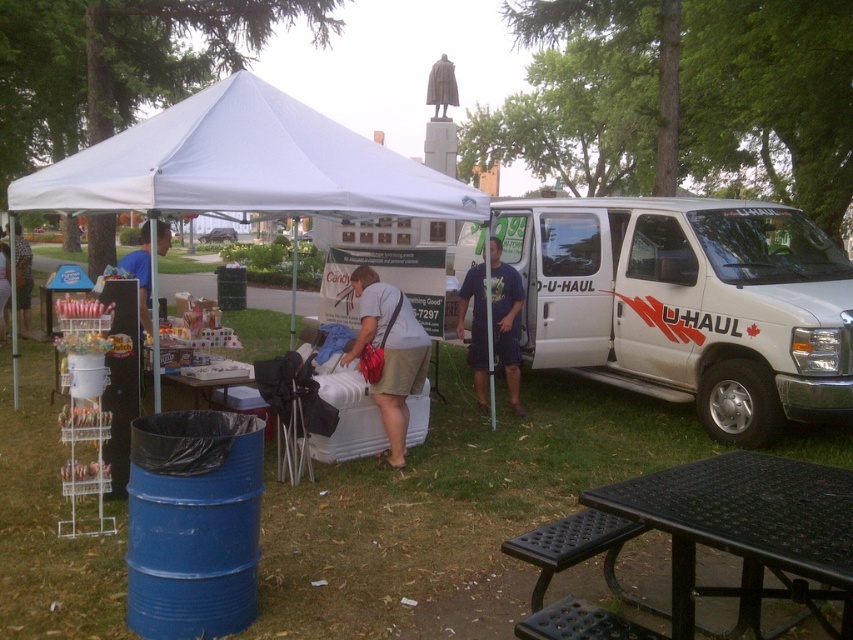
Between white matte van at right and matte black shirt at center, which one appears on the right side from the viewer's perspective?

From the viewer's perspective, white matte van at right appears more on the right side.

Can you confirm if white matte van at right is thinner than matte black shirt at center?

No, white matte van at right is not thinner than matte black shirt at center.

Between point (546, 298) and point (15, 221), which one is positioned in front?

Point (546, 298)

Locate an element on the screen. white matte van at right is located at coordinates (688, 305).

Can you confirm if white matte van at right is bigger than black metal picnic table at lower right?

Yes.

Is point (653, 330) more distant than point (708, 493)?

Yes, point (653, 330) is farther from viewer.

The image size is (853, 640). In order to click on white matte van at right in this screenshot , I will do `click(688, 305)`.

Which of these two, matte white cooler at center or matte black shirt at center, stands taller?

matte black shirt at center is taller.

Does matte white cooler at center appear under matte black shirt at center?

Indeed, matte white cooler at center is positioned under matte black shirt at center.

Is point (386, 419) closer to camera compared to point (21, 307)?

Yes, it is.

You are a GUI agent. You are given a task and a screenshot of the screen. Output one action in this format:
    pyautogui.click(x=<x>, y=<y>)
    Task: Click on the matte white cooler at center
    Image resolution: width=853 pixels, height=640 pixels.
    Given the screenshot: What is the action you would take?
    pyautogui.click(x=389, y=355)